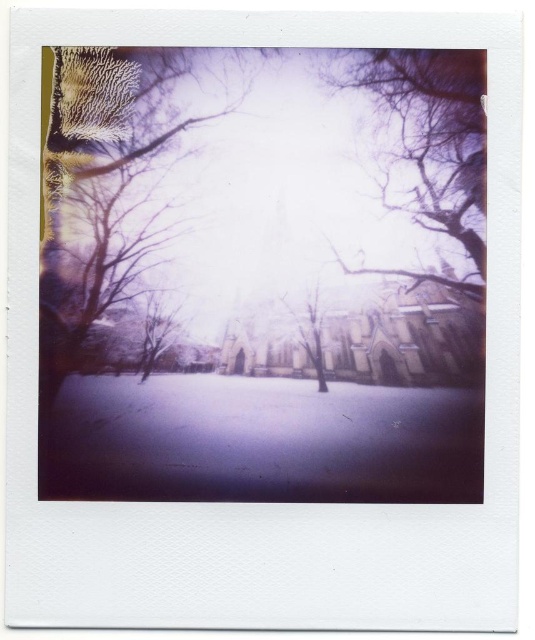
Question: Can you confirm if translucent purple branches at upper right is positioned below smooth brown tree at center?

Choices:
 (A) yes
 (B) no

Answer: (B)

Question: Which point appears closest to the camera in this image?

Choices:
 (A) (151, 321)
 (B) (307, 346)

Answer: (A)

Question: Can you confirm if smooth bark tree at left is bigger than translucent purple branches at upper right?

Choices:
 (A) yes
 (B) no

Answer: (A)

Question: Which point is farther to the camera?

Choices:
 (A) (441, 225)
 (B) (128, 355)

Answer: (B)

Question: Which point is farther from the camera taking this photo?

Choices:
 (A) (54, 236)
 (B) (386, 51)
 (C) (304, 310)

Answer: (C)

Question: From the image, what is the correct spatial relationship of smooth bark tree at left in relation to translucent purple branches at upper right?

Choices:
 (A) above
 (B) below

Answer: (B)